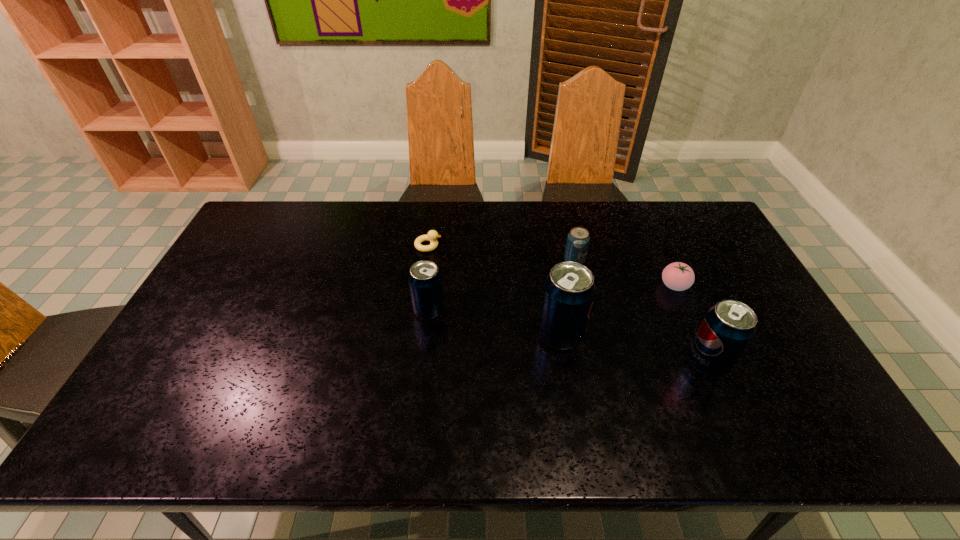
I want to click on the second shortest pop soda, so click(425, 279).

What are the coordinates of `the third tallest object` in the screenshot? It's located at (425, 279).

Locate an element on the screen. The height and width of the screenshot is (540, 960). the rightmost pop soda is located at coordinates (728, 327).

You are a GUI agent. You are given a task and a screenshot of the screen. Output one action in this format:
    pyautogui.click(x=<x>, y=<y>)
    Task: Click on the fifth shortest object
    This screenshot has width=960, height=540.
    Given the screenshot: What is the action you would take?
    pyautogui.click(x=728, y=327)

Find the location of a particular element. The image size is (960, 540). duckling is located at coordinates (432, 235).

Locate an element on the screen. the farthest object is located at coordinates (432, 235).

Where is `the second shortest object`? Image resolution: width=960 pixels, height=540 pixels. the second shortest object is located at coordinates (677, 276).

The image size is (960, 540). What are the coordinates of `tomato` in the screenshot? It's located at (677, 276).

The image size is (960, 540). What are the coordinates of `the farthest pop soda` in the screenshot? It's located at (578, 238).

Locate an element on the screen. the third shortest object is located at coordinates (578, 238).